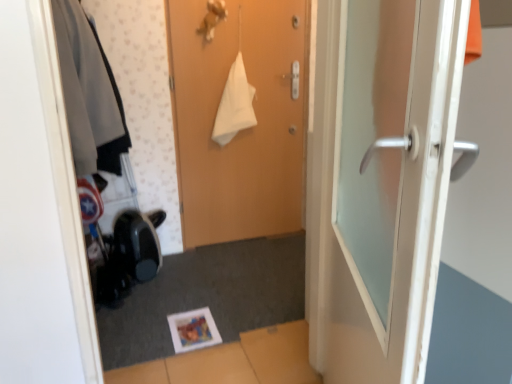
Question: Considering the positions of wooden door at center, the first door in the back-to-front sequence, and white glossy door at right, arranged as the second door when viewed from the back, in the image, is wooden door at center, the first door in the back-to-front sequence, bigger or smaller than white glossy door at right, arranged as the second door when viewed from the back,?

Choices:
 (A) small
 (B) big

Answer: (A)

Question: Is wooden door at center, the first door in the back-to-front sequence, inside or outside of white glossy door at right, the first door in the front-to-back sequence?

Choices:
 (A) outside
 (B) inside

Answer: (A)

Question: Which is nearer to the white glossy door at right, the first door in the front-to-back sequence?

Choices:
 (A) wooden door at center, the first door in the back-to-front sequence
 (B) matte gray jacket at left

Answer: (B)

Question: Which is farther from the matte gray jacket at left?

Choices:
 (A) wooden door at center, which is counted as the 2th door, starting from the front
 (B) white glossy door at right, arranged as the second door when viewed from the back

Answer: (B)